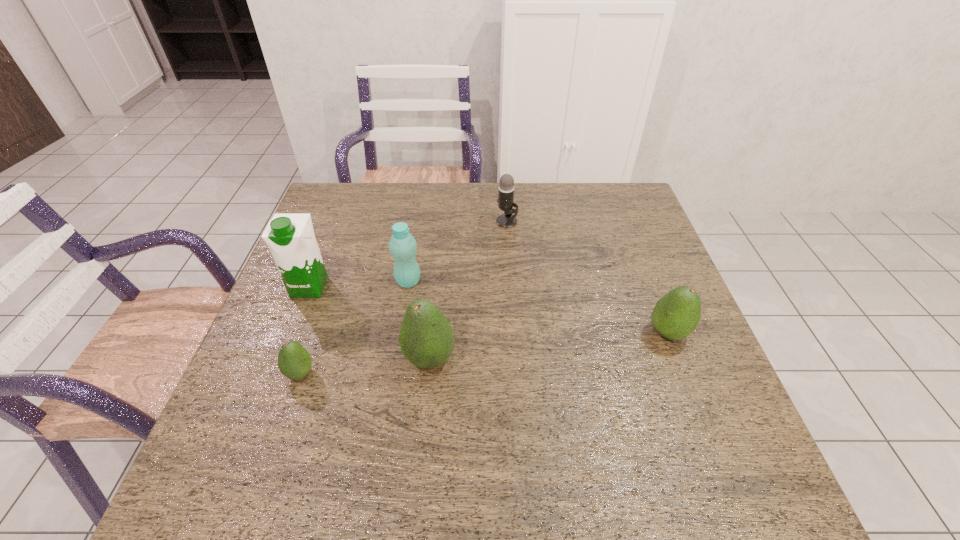
Please determine a free point for an extra avocado to ensure balance. Please provide its 2D coordinates. Your answer should be formatted as a tuple, i.e. [(x, y)], where the tuple contains the x and y coordinates of a point satisfying the conditions above.

[(552, 346)]